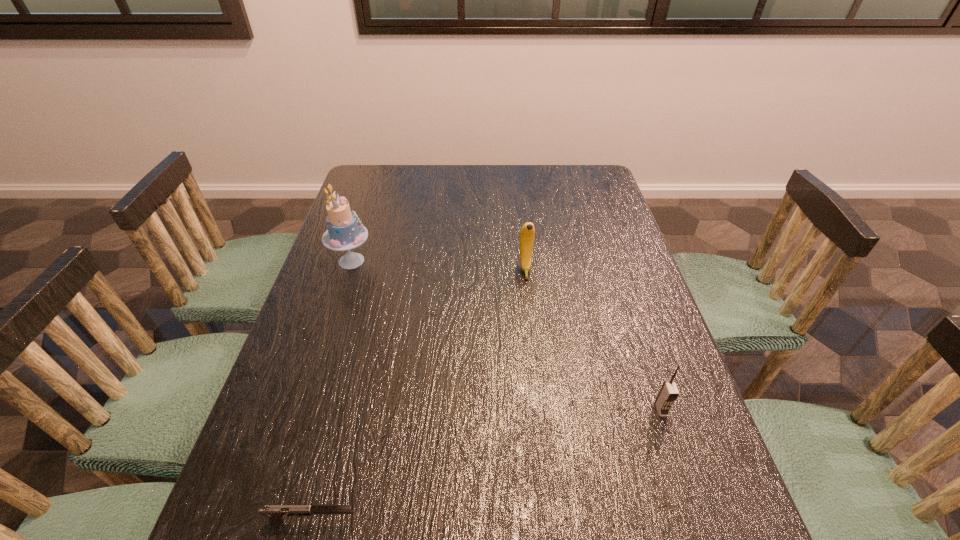
In order to click on cake that is at the left edge in this screenshot , I will do `click(345, 231)`.

Where is `gun situated at the left edge`? Image resolution: width=960 pixels, height=540 pixels. gun situated at the left edge is located at coordinates (275, 512).

At what (x,y) coordinates should I click in order to perform the action: click on object that is positioned at the right edge. Please return your answer as a coordinate pair (x, y). The image size is (960, 540). Looking at the image, I should click on (668, 393).

I want to click on vacant area at the far edge, so click(x=550, y=171).

Where is `vacant space at the left edge of the desktop`? The height and width of the screenshot is (540, 960). vacant space at the left edge of the desktop is located at coordinates (342, 335).

This screenshot has height=540, width=960. I want to click on free region at the right edge of the desktop, so click(715, 504).

The image size is (960, 540). In order to click on free space between the rightmost object and the second object from right to left in this screenshot , I will do `click(593, 340)`.

At what (x,y) coordinates should I click in order to perform the action: click on blank region between the cake and the banana. Please return your answer as a coordinate pair (x, y). Image resolution: width=960 pixels, height=540 pixels. Looking at the image, I should click on (439, 265).

At what (x,y) coordinates should I click in order to perform the action: click on unoccupied area between the banana and the second shortest object. Please return your answer as a coordinate pair (x, y). The width and height of the screenshot is (960, 540). Looking at the image, I should click on (593, 340).

The image size is (960, 540). What are the coordinates of `vacant area that lies between the tallest object and the shortest object` in the screenshot? It's located at (332, 390).